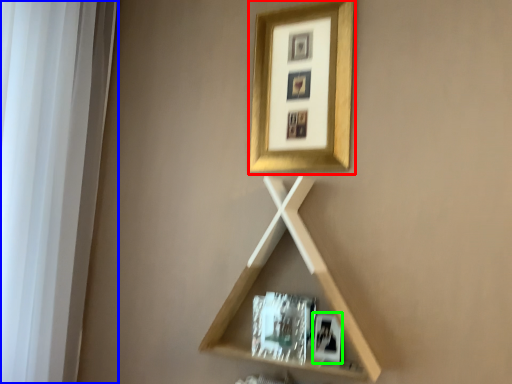
Question: Estimate the real-world distances between objects in this image. Which object is closer to picture frame (highlighted by a red box), window frame (highlighted by a blue box) or picture frame (highlighted by a green box)?

Choices:
 (A) window frame
 (B) picture frame

Answer: (B)